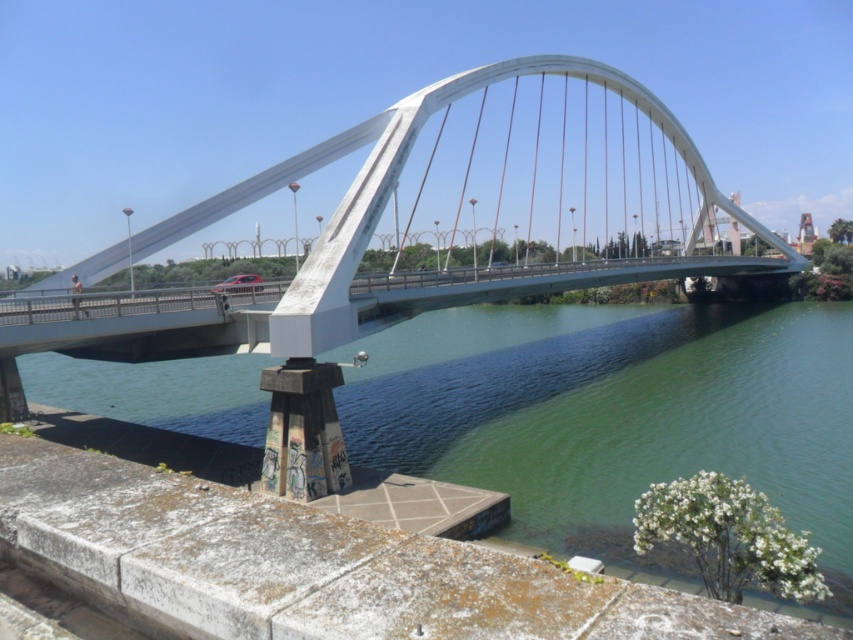
Between point (809, 324) and point (345, 136), which one is positioned in front?

Point (345, 136) is more forward.

Does green concrete river at lower center have a lesser width compared to white metallic arch bridge at center?

In fact, green concrete river at lower center might be wider than white metallic arch bridge at center.

This screenshot has height=640, width=853. What are the coordinates of `green concrete river at lower center` in the screenshot? It's located at (622, 404).

Image resolution: width=853 pixels, height=640 pixels. In order to click on green concrete river at lower center in this screenshot , I will do `click(622, 404)`.